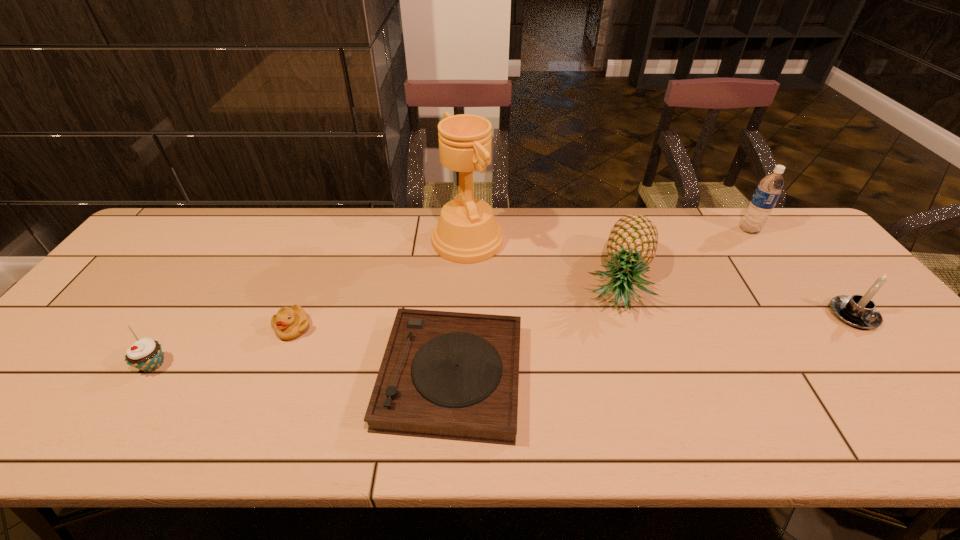
This screenshot has height=540, width=960. What are the coordinates of `free space located on the front of the tallest object` in the screenshot? It's located at (464, 341).

The height and width of the screenshot is (540, 960). In order to click on vacant space situated on the front of the second tallest object in this screenshot , I will do `click(804, 302)`.

Image resolution: width=960 pixels, height=540 pixels. I want to click on free region located 0.290m on the right of the pineapple, so click(x=762, y=281).

This screenshot has width=960, height=540. In order to click on free point located 0.170m with a handle on the side of the rightmost object in this screenshot , I will do `click(916, 392)`.

Identify the location of free region located 0.220m on the right of the cupcake. (263, 364).

Image resolution: width=960 pixels, height=540 pixels. In order to click on vacant space located on the front-facing side of the sixth tallest object in this screenshot , I will do `click(255, 421)`.

Where is `blank space located on the right of the phonograph record`? blank space located on the right of the phonograph record is located at coordinates (585, 376).

The width and height of the screenshot is (960, 540). Find the location of `award positioned at the far edge`. award positioned at the far edge is located at coordinates (467, 232).

Image resolution: width=960 pixels, height=540 pixels. Identify the location of water bottle located at the far edge. (768, 191).

At what (x,y) coordinates should I click in order to perform the action: click on pineapple present at the far edge. Please return your answer as a coordinate pair (x, y). This screenshot has width=960, height=540. Looking at the image, I should click on (632, 243).